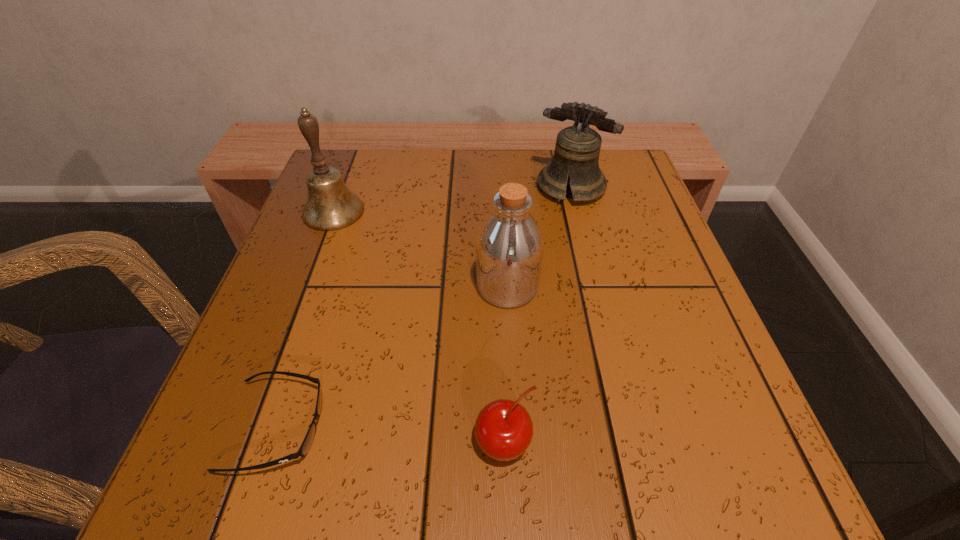
At what (x,y) coordinates should I click in order to perform the action: click on free space between the third farthest object and the taller bell. Please return your answer as a coordinate pair (x, y). The width and height of the screenshot is (960, 540). Looking at the image, I should click on (420, 249).

Locate an element on the screen. The image size is (960, 540). unoccupied area between the cherry and the rightmost object is located at coordinates (538, 315).

This screenshot has width=960, height=540. I want to click on blank region between the rightmost object and the cherry, so click(x=538, y=315).

The image size is (960, 540). Identify the location of vacant area between the third farthest object and the taller bell. click(x=420, y=249).

Locate an element on the screen. The height and width of the screenshot is (540, 960). free space between the taller bell and the shortest object is located at coordinates coord(305,319).

Image resolution: width=960 pixels, height=540 pixels. In order to click on object that is the second nearest to the rightmost object in this screenshot , I will do `click(330, 206)`.

Select which object is the closest to the left bell. Please provide its 2D coordinates. Your answer should be formatted as a tuple, i.e. [(x, y)], where the tuple contains the x and y coordinates of a point satisfying the conditions above.

[(509, 250)]

Where is `free space that satisfies the following two spatial constraints: 1. on the front-facing side of the shortest object; 2. on the back side of the cherry`? This screenshot has width=960, height=540. free space that satisfies the following two spatial constraints: 1. on the front-facing side of the shortest object; 2. on the back side of the cherry is located at coordinates (271, 443).

Locate an element on the screen. The width and height of the screenshot is (960, 540). free spot that satisfies the following two spatial constraints: 1. on the front-facing side of the fourth tallest object; 2. on the left side of the sunglasses is located at coordinates (271, 443).

Find the location of `vacant area that satisfies the following two spatial constraints: 1. on the back side of the second shortest object; 2. on the front-facing side of the shortest object`. vacant area that satisfies the following two spatial constraints: 1. on the back side of the second shortest object; 2. on the front-facing side of the shortest object is located at coordinates (503, 427).